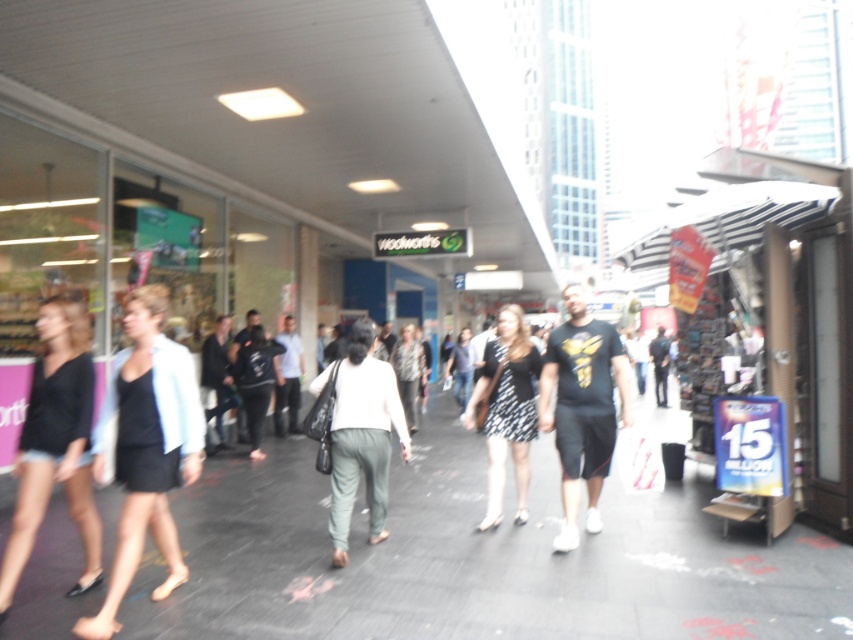
Question: Among these points, which one is nearest to the camera?

Choices:
 (A) (112, 593)
 (B) (212, 451)
 (C) (561, 381)
 (D) (527, 468)

Answer: (A)

Question: Which of these objects is positioned closest to the black dotted dress at center?

Choices:
 (A) black fabric skirt at center
 (B) black matte t-shirt at center
 (C) light blue shirt at center

Answer: (B)

Question: Which is farther from the dark blue jeans at center?

Choices:
 (A) light gray cotton pants at center
 (B) black fabric skirt at center
 (C) black matte t-shirt at center
 (D) light blue shirt at center

Answer: (C)

Question: Observing the image, what is the correct spatial positioning of black fabric skirt at center in reference to dark gray jacket at center?

Choices:
 (A) below
 (B) above

Answer: (B)

Question: Does black matte t-shirt at center have a smaller size compared to light gray cotton pants at center?

Choices:
 (A) yes
 (B) no

Answer: (B)

Question: Where is black matte t-shirt at center located in relation to light gray cotton pants at center in the image?

Choices:
 (A) above
 (B) below

Answer: (A)